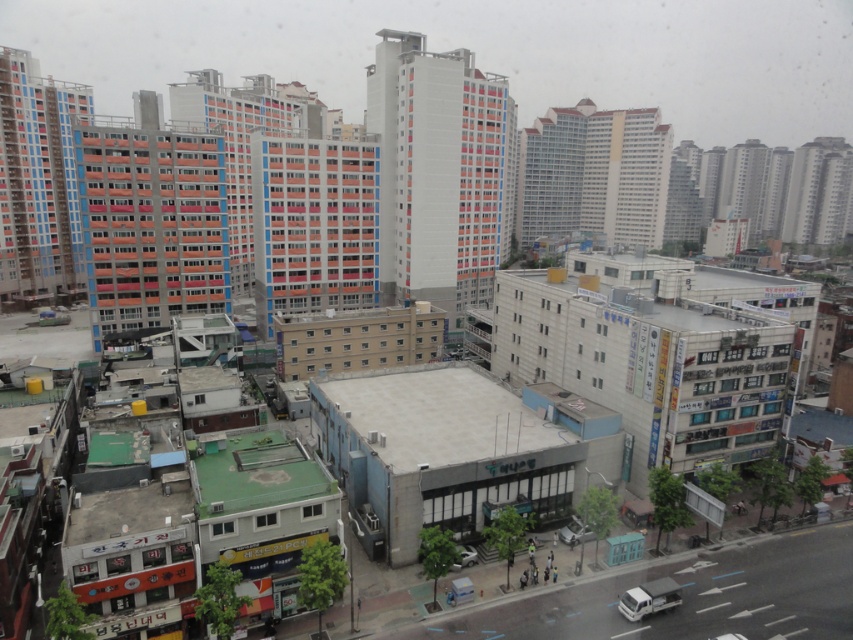
Is point (674, 580) farther from viewer compared to point (469, 556)?

No, it is in front of (469, 556).

Does white matte van at lower right appear on the right side of metallic silver car at center?

Correct, you'll find white matte van at lower right to the right of metallic silver car at center.

Between point (668, 582) and point (459, 566), which one is positioned in front?

Positioned in front is point (668, 582).

This screenshot has height=640, width=853. Find the location of `white matte van at lower right`. white matte van at lower right is located at coordinates (648, 598).

Is white matte van at lower right shorter than white matte car at center?

Incorrect, white matte van at lower right's height does not fall short of white matte car at center's.

Which is more to the right, white matte van at lower right or white matte car at center?

From the viewer's perspective, white matte van at lower right appears more on the right side.

The height and width of the screenshot is (640, 853). What are the coordinates of `white matte van at lower right` in the screenshot? It's located at (648, 598).

Can you confirm if white matte car at center is wider than metallic silver car at center?

No, white matte car at center is not wider than metallic silver car at center.

Is white matte car at center taller than metallic silver car at center?

No.

This screenshot has width=853, height=640. I want to click on white matte car at center, so click(573, 532).